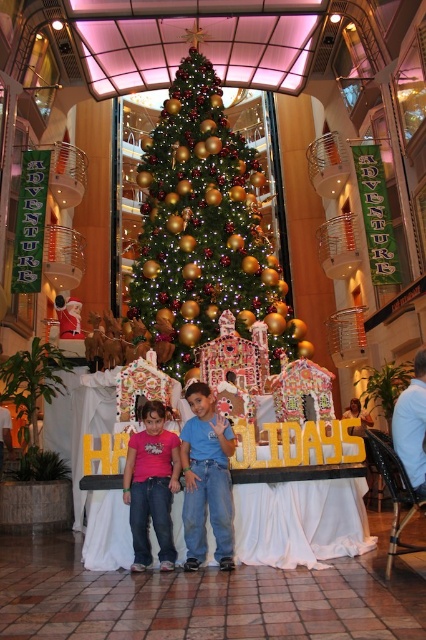
Which of these two, green matte christmas tree at center or matte pink shirt at center, stands shorter?

Standing shorter between the two is matte pink shirt at center.

Between green matte christmas tree at center and matte pink shirt at center, which one appears on the right side from the viewer's perspective?

matte pink shirt at center

Does point (144, 198) come closer to viewer compared to point (135, 461)?

That is False.

I want to click on green matte christmas tree at center, so click(x=203, y=230).

Who is more distant from viewer, [186,317] or [189,496]?

Positioned behind is point [186,317].

Does green matte christmas tree at center appear on the right side of blue cotton shirt at center?

In fact, green matte christmas tree at center is to the left of blue cotton shirt at center.

Between point (154, 145) and point (230, 484), which one is positioned behind?

Point (154, 145)

Locate an element on the screen. The height and width of the screenshot is (640, 426). green matte christmas tree at center is located at coordinates (203, 230).

Does blue cotton shirt at center appear on the right side of matte pink shirt at center?

Indeed, blue cotton shirt at center is positioned on the right side of matte pink shirt at center.

Which is in front, point (198, 422) or point (155, 419)?

Point (155, 419)

Describe the element at coordinates (206, 480) in the screenshot. I see `blue cotton shirt at center` at that location.

Locate an element on the screen. blue cotton shirt at center is located at coordinates (206, 480).